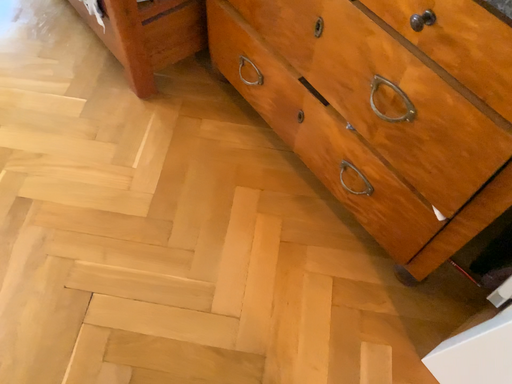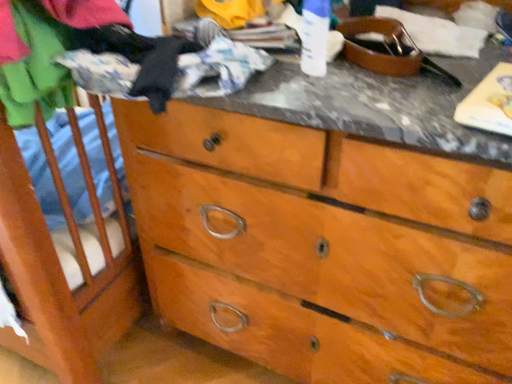
Question: How did the camera likely rotate when shooting the video?

Choices:
 (A) rotated upward
 (B) rotated downward

Answer: (A)